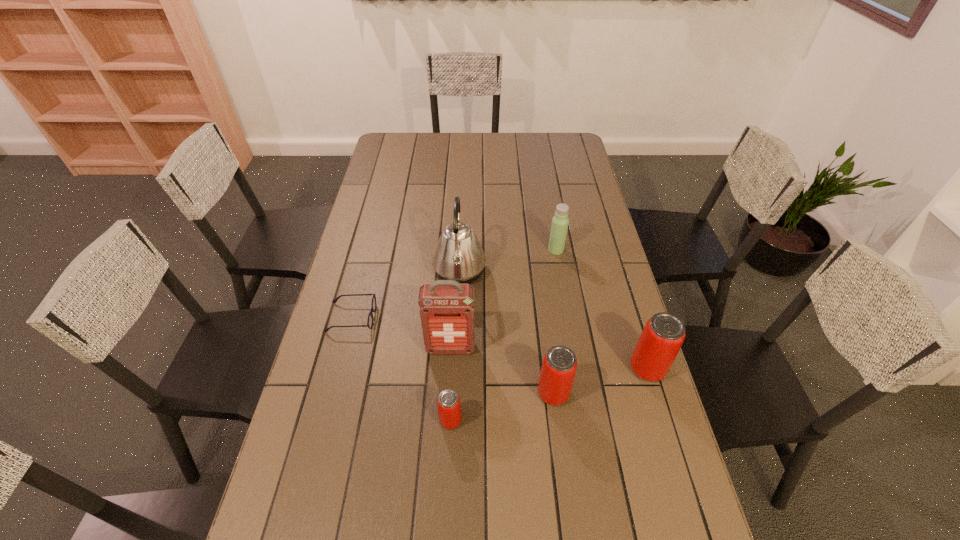
Please point a free position for a beer can on the left. Please provide its 2D coordinates. Your answer should be formatted as a tuple, i.e. [(x, y)], where the tuple contains the x and y coordinates of a point satisfying the conditions above.

[(338, 450)]